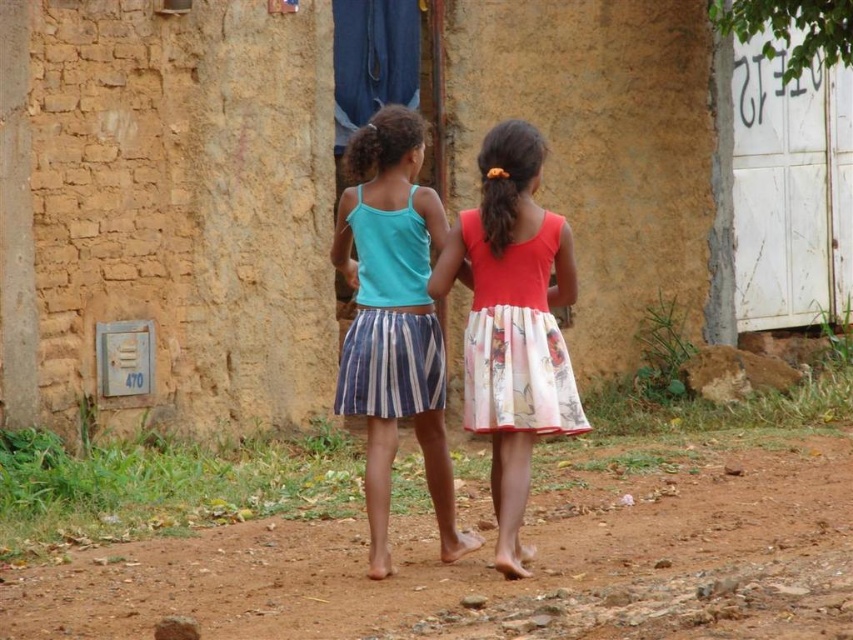
Locate an element on the screen. The image size is (853, 640). striped cotton skirt at center is located at coordinates (393, 321).

Between point (370, 568) and point (483, 316), which one is positioned behind?

Point (370, 568)

Image resolution: width=853 pixels, height=640 pixels. I want to click on striped cotton skirt at center, so click(x=393, y=321).

Who is more forward, (376, 342) or (373, 298)?

Positioned in front is point (376, 342).

Can you confirm if striped cotton skirt at center is shorter than striped cotton dress at center?

No.

This screenshot has width=853, height=640. What do you see at coordinates (393, 321) in the screenshot?
I see `striped cotton skirt at center` at bounding box center [393, 321].

This screenshot has height=640, width=853. I want to click on striped cotton skirt at center, so click(x=393, y=321).

Is matte pink dress at center smaller than striped cotton dress at center?

No.

Is matte pink dress at center closer to camera compared to striped cotton dress at center?

Yes, matte pink dress at center is closer to the viewer.

Does point (512, 280) come behind point (358, 298)?

No, it is in front of (358, 298).

Where is `matte pink dress at center`? matte pink dress at center is located at coordinates (512, 323).